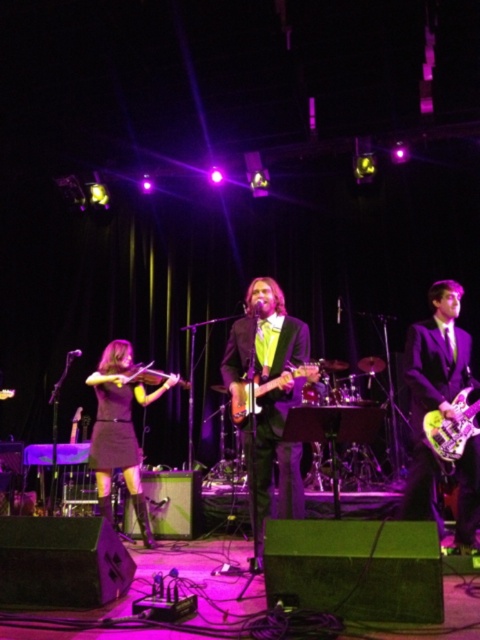
You are a photographer at the back of the venue trying to capture a clear shot of both the shiny black suit at center and the wooden acoustic guitar at center. Which object will appear larger in your photo?

The shiny black suit at center will appear larger in the photo because it is much taller than the wooden acoustic guitar at center.

You are standing at the front of the stage and want to take a photo of the violinist and the guitarist. The camera you are using has a focal length of 50mm and a sensor size of 24mm x 36mm. Given that the point at coordinates point (250,365) is 3.91 meters away from the camera, can you determine if both the violinist and the guitarist are within the camera frame?

The point at coordinates point (250,365) is 3.91 meters from the camera. To determine if both musicians are within the frame, calculate the camera field of view. With a 50mm lens on a full frame sensor, the horizontal FOV is approximately 39.6 degrees and vertical FOV 27 degrees. At 3.91 meters distance, the maximum horizontal coverage is about 5.6 meters and vertical 2.9 meters. Since the musicians are on stage within this area, they should be fully inside the frame.

You are a stagehand who needs to move the purple glossy guitar at center and the shiny purple electric guitar at right to the storage room. If you start from the left side of the stage, which guitar should you pick up first to follow the correct order?

You should pick up the purple glossy guitar at center first because it is located to the left of the shiny purple electric guitar at right, so starting from the left side of the stage, you encounter it first.